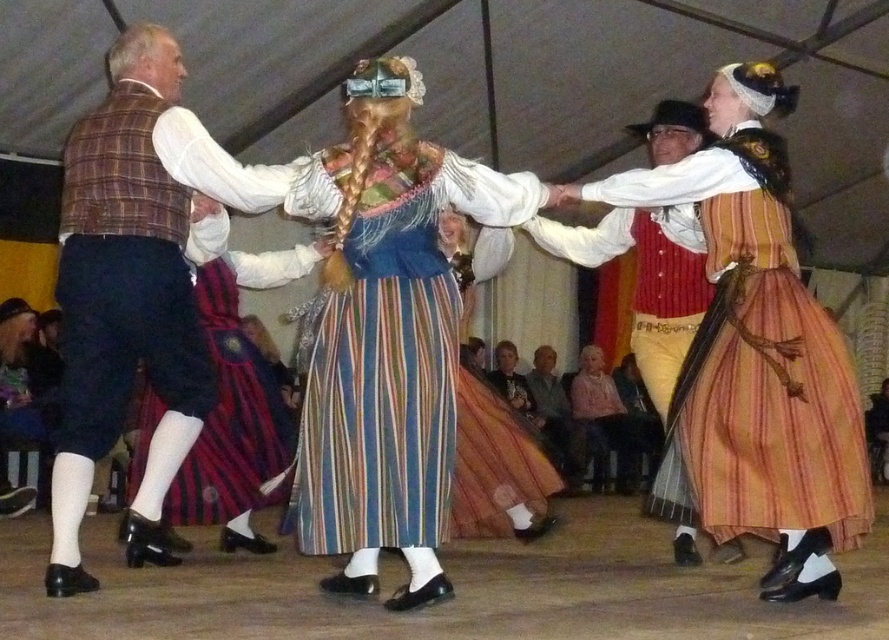
You are a photographer at the folk dance event and want to capture a photo of the striped fabric dress at center and the striped cotton dress at center. Which one appears shorter in the photo?

The striped fabric dress at center appears shorter because it is not as tall as the striped cotton dress at center.

You are a photographer standing at the center of the dance floor. You want to take a photo that includes both the point at location [345,292] and the point at [590,413]. Which point should you focus on first to ensure both are in sharp focus?

You should focus on point [345,292] first because it is closer to the camera than point [590,413]. This ensures that both points will be within the depth of field and in sharp focus.